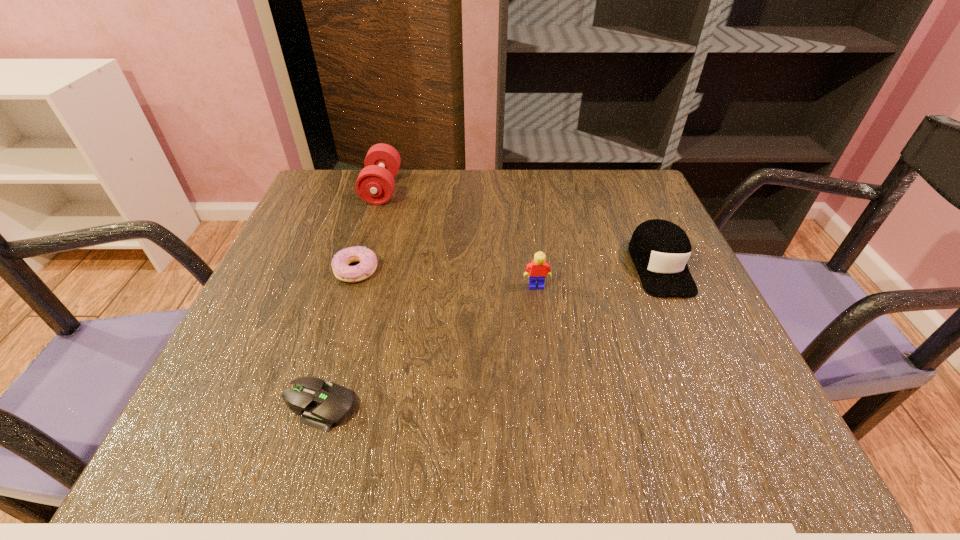
The width and height of the screenshot is (960, 540). I want to click on vacant space situated 0.340m on the back of the computer mouse, so click(x=367, y=247).

Locate an element on the screen. object that is at the far edge is located at coordinates (375, 184).

Where is `object that is at the near edge`? object that is at the near edge is located at coordinates (322, 404).

Find the location of a particular element. The height and width of the screenshot is (540, 960). dumbbell located at the left edge is located at coordinates (375, 184).

At what (x,y) coordinates should I click in order to perform the action: click on doughnut that is at the left edge. Please return your answer as a coordinate pair (x, y). The width and height of the screenshot is (960, 540). Looking at the image, I should click on (368, 261).

Where is `computer mouse that is positioned at the left edge`? The image size is (960, 540). computer mouse that is positioned at the left edge is located at coordinates (322, 404).

Where is `object that is at the right edge`? object that is at the right edge is located at coordinates (660, 249).

This screenshot has height=540, width=960. In order to click on object located at the far left corner in this screenshot , I will do `click(375, 184)`.

Where is `object present at the near left corner`? This screenshot has height=540, width=960. object present at the near left corner is located at coordinates (322, 404).

This screenshot has width=960, height=540. Find the location of `blank space at the far edge of the desktop`. blank space at the far edge of the desktop is located at coordinates (497, 199).